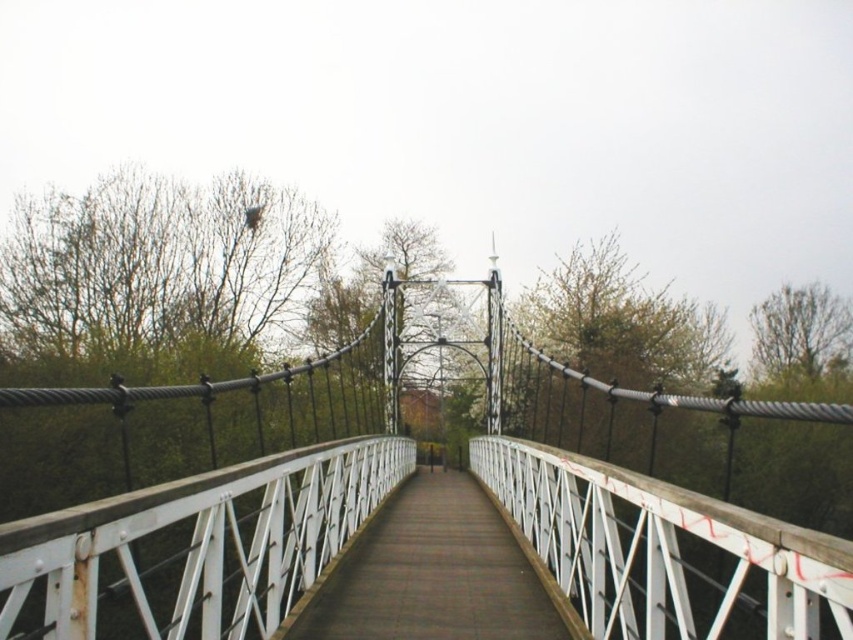
In the scene shown: Is white metal suspension bridge at center positioned at the back of white metal bridge at center?

No, white metal suspension bridge at center is in front of white metal bridge at center.

Who is positioned more to the right, white metal suspension bridge at center or white metal bridge at center?

From the viewer's perspective, white metal suspension bridge at center appears more on the right side.

Does point (561, 387) lie behind point (477, 483)?

Yes, it is behind point (477, 483).

I want to click on white metal suspension bridge at center, so click(210, 513).